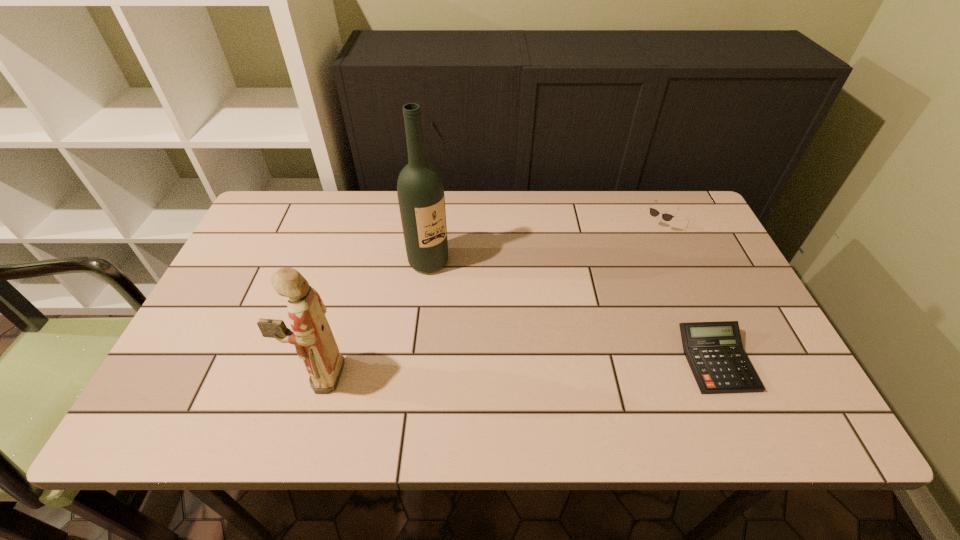
Where is `blank space located 0.240m on the back of the calculator`? The width and height of the screenshot is (960, 540). blank space located 0.240m on the back of the calculator is located at coordinates (673, 261).

Where is `vacant area located 0.250m on the labeled side of the second farthest object`? vacant area located 0.250m on the labeled side of the second farthest object is located at coordinates (495, 335).

Locate an element on the screen. The height and width of the screenshot is (540, 960). free space located on the labeled side of the second farthest object is located at coordinates (534, 377).

I want to click on free space located on the labeled side of the second farthest object, so [495, 335].

The width and height of the screenshot is (960, 540). I want to click on vacant area located in front of the lenses of the second shortest object, so click(x=584, y=331).

Find the location of a particular element. The width and height of the screenshot is (960, 540). free location located 0.370m in front of the lenses of the second shortest object is located at coordinates (589, 323).

This screenshot has height=540, width=960. In order to click on vacant space located 0.190m in front of the lenses of the second shortest object in this screenshot , I will do `click(618, 279)`.

This screenshot has width=960, height=540. I want to click on object located in the far edge section of the desktop, so click(666, 217).

What are the coordinates of `figurine that is at the near edge` in the screenshot? It's located at (312, 336).

You are a GUI agent. You are given a task and a screenshot of the screen. Output one action in this format:
    pyautogui.click(x=<x>, y=<y>)
    Task: Click on the calculator that is at the near edge
    The image size is (960, 540).
    Given the screenshot: What is the action you would take?
    pyautogui.click(x=714, y=351)